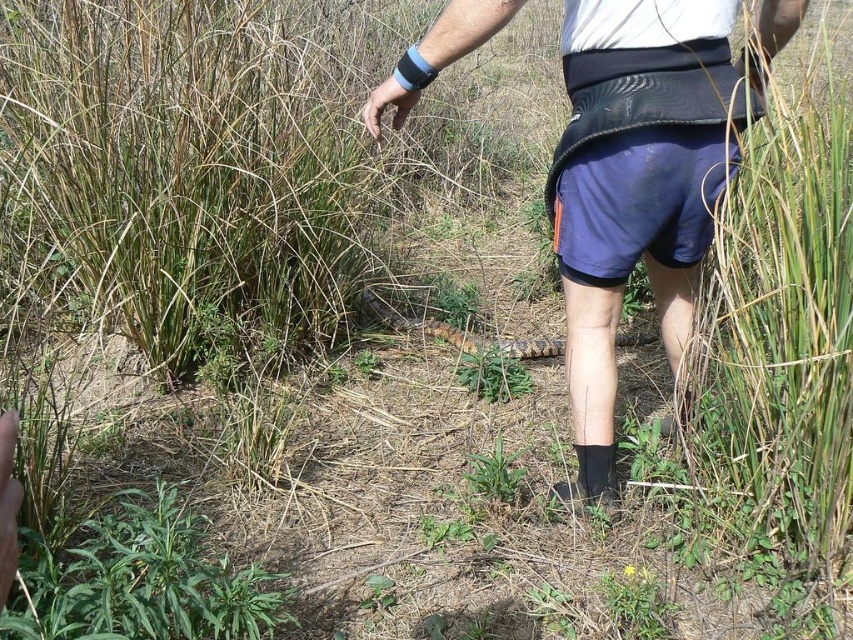
Consider the image. Based on the scene, if the person wearing the blue fabric shorts at center wants to avoid stepping on the green leafy plant at lower left, which direction should they move? Please consider their current position and the spatial relationship between the objects.

The blue fabric shorts at center is located above the green leafy plant at lower left, so the person should move downward or backward to avoid stepping on the green leafy plant at lower left.

You are a photographer trying to capture the blue fabric shorts at center in the image. What are the exact coordinates where you should focus your camera to ensure the shorts are centered in your shot?

The exact coordinates to focus on are point (637,184) to center the blue fabric shorts at center in your shot.

You are a photographer trying to capture the blue fabric shorts at center and the green leafy plant at lower left in the same frame. Can you see both objects clearly in your current position?

The green leafy plant at lower left is behind the blue fabric shorts at center, so you cannot see both objects clearly in the same frame because the blue fabric shorts at center is blocking the view of the green leafy plant at lower left.